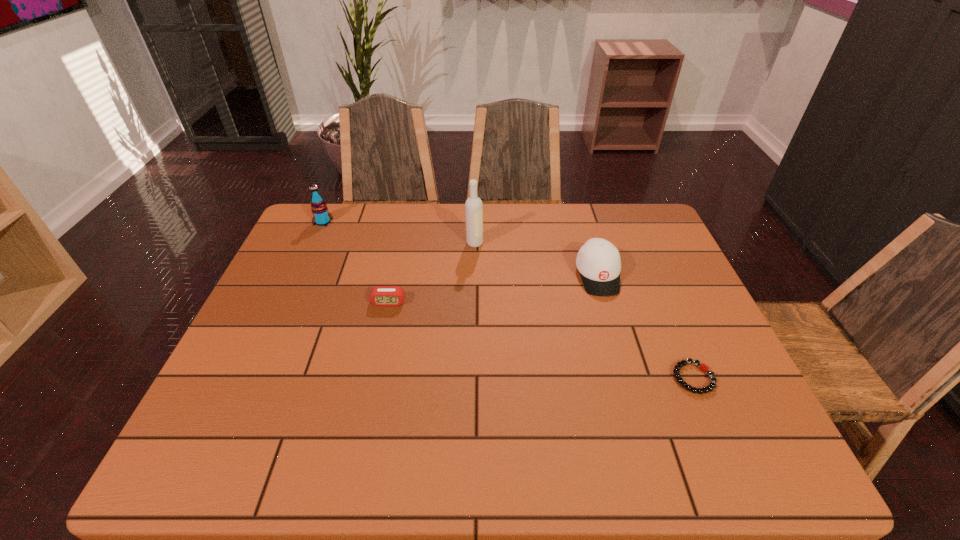
This screenshot has width=960, height=540. In order to click on free spot located on the right of the fourth nearest object in this screenshot , I will do `click(536, 243)`.

The width and height of the screenshot is (960, 540). In order to click on free location located on the front of the fourth shortest object in this screenshot , I will do `click(309, 253)`.

Image resolution: width=960 pixels, height=540 pixels. What are the coordinates of `vacant space located on the front-facing side of the third shortest object` in the screenshot? It's located at (637, 409).

Identify the location of free space located 0.090m on the front-facing side of the second shortest object. Image resolution: width=960 pixels, height=540 pixels. (382, 333).

This screenshot has height=540, width=960. Identify the location of vacant space situated 0.070m on the left of the nearest object. tap(641, 377).

The height and width of the screenshot is (540, 960). I want to click on vodka present at the far edge, so click(473, 206).

The width and height of the screenshot is (960, 540). What are the coordinates of `soda that is at the far edge` in the screenshot? It's located at (322, 217).

You are a GUI agent. You are given a task and a screenshot of the screen. Output one action in this format:
    pyautogui.click(x=<x>, y=<y>)
    Task: Click on the object that is at the left edge
    The width and height of the screenshot is (960, 540).
    Given the screenshot: What is the action you would take?
    pyautogui.click(x=322, y=217)

Locate an element on the screen. This screenshot has width=960, height=540. object located in the right edge section of the desktop is located at coordinates (703, 367).

Image resolution: width=960 pixels, height=540 pixels. I want to click on object positioned at the far left corner, so click(x=322, y=217).